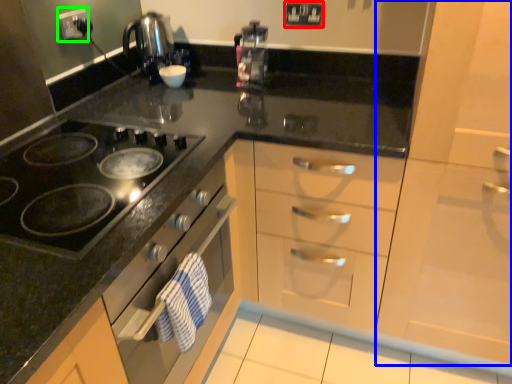
Question: Considering the real-world distances, which object is closest to electric outlet (highlighted by a red box)? cabinetry (highlighted by a blue box) or electric outlet (highlighted by a green box).

Choices:
 (A) cabinetry
 (B) electric outlet

Answer: (B)